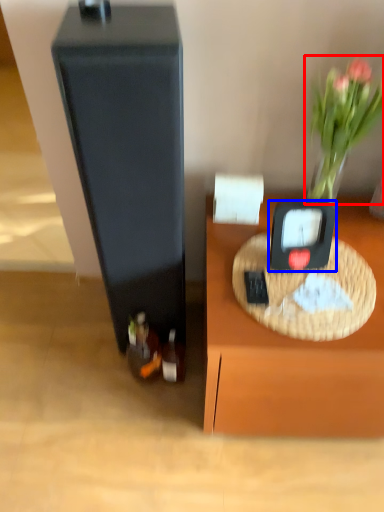
Question: Which object is further to the camera taking this photo, plant (highlighted by a red box) or weight scale (highlighted by a blue box)?

Choices:
 (A) plant
 (B) weight scale

Answer: (B)